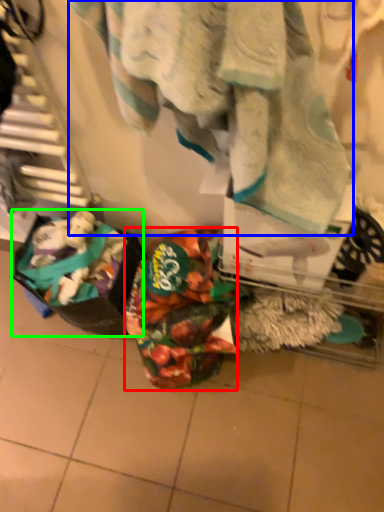
Question: Based on their relative distances, which object is farther from waste (highlighted by a red box)? Choose from towel (highlighted by a blue box) and waste (highlighted by a green box).

Choices:
 (A) towel
 (B) waste

Answer: (A)